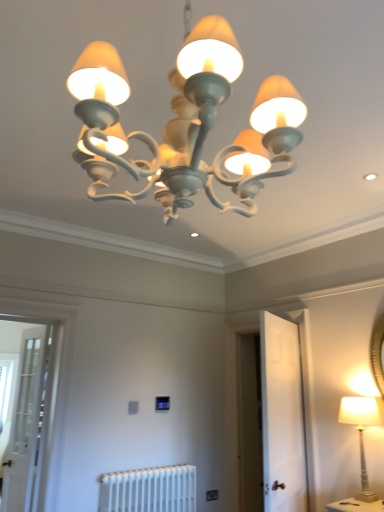
Question: In terms of height, does white painted wood lamp at right, the second lamp viewed from the front, look taller or shorter compared to white metallic radiator at lower center?

Choices:
 (A) tall
 (B) short

Answer: (A)

Question: Is white painted wood lamp at right, marked as the 1th lamp in a bottom-to-top arrangement, bigger or smaller than white metallic radiator at lower center?

Choices:
 (A) big
 (B) small

Answer: (B)

Question: Considering the real-world distances, which object is closest to the clear glass screen door at left, which is the first screen door in left-to-right order?

Choices:
 (A) matte white chandelier at upper center, which ranks as the first lamp in top-to-bottom order
 (B) white matte door at center, the 1th screen door viewed from the right
 (C) white metallic radiator at lower center
 (D) white painted wood lamp at right, which is the second lamp in left-to-right order

Answer: (C)

Question: Which of these objects is positioned closest to the white painted wood lamp at right, the first lamp positioned from the back?

Choices:
 (A) white matte door at center, the 1th screen door viewed from the right
 (B) matte white chandelier at upper center, placed as the second lamp when sorted from back to front
 (C) clear glass screen door at left, marked as the 2th screen door in a right-to-left arrangement
 (D) white metallic radiator at lower center

Answer: (A)